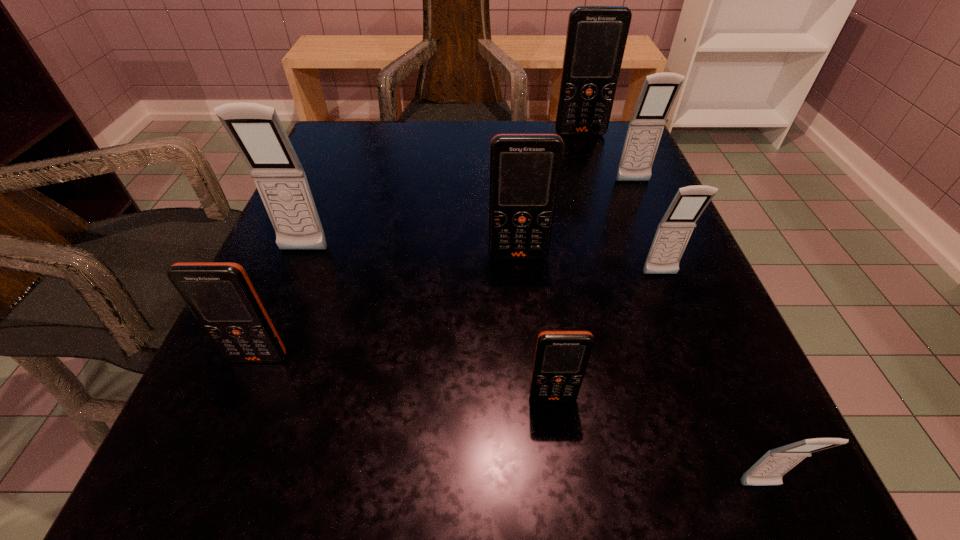
Locate an element on the screen. This screenshot has width=960, height=540. vacant region between the farthest object and the seventh farthest object is located at coordinates (566, 266).

You are a GUI agent. You are given a task and a screenshot of the screen. Output one action in this format:
    pyautogui.click(x=<x>, y=<y>)
    Task: Click on the unoccupied area between the rightmost orange cellular telephone and the leftmost gray cellular telephone
    
    Given the screenshot: What is the action you would take?
    pyautogui.click(x=442, y=192)

Where is `vacant area between the fifth farthest object and the second nearest cellular telephone`? vacant area between the fifth farthest object and the second nearest cellular telephone is located at coordinates (607, 336).

Identify which object is the seventh nearest to the smallest gray cellular telephone. Please provide its 2D coordinates. Your answer should be formatted as a tuple, i.e. [(x, y)], where the tuple contains the x and y coordinates of a point satisfying the conditions above.

[(596, 38)]

Where is `object identified as the fifth closest to the nearest object`? This screenshot has height=540, width=960. object identified as the fifth closest to the nearest object is located at coordinates (x=220, y=295).

At what (x,y) coordinates should I click in order to perform the action: click on the fifth closest cellular telephone relative to the fifth farthest object. Please return your answer as a coordinate pair (x, y). The width and height of the screenshot is (960, 540). Looking at the image, I should click on coord(596,38).

This screenshot has height=540, width=960. I want to click on cellular telephone that is the second nearest to the second nearest orange cellular telephone, so click(x=561, y=357).

Where is `orange cellular telephone that is the closest one to the farthest gray cellular telephone`? The image size is (960, 540). orange cellular telephone that is the closest one to the farthest gray cellular telephone is located at coordinates (596, 38).

In order to click on the fourth closest orange cellular telephone to the nearest cellular telephone in this screenshot , I will do `click(596, 38)`.

Identify which gray cellular telephone is the second nearest to the second farthest object. Please provide its 2D coordinates. Your answer should be formatted as a tuple, i.e. [(x, y)], where the tuple contains the x and y coordinates of a point satisfying the conditions above.

[(769, 469)]